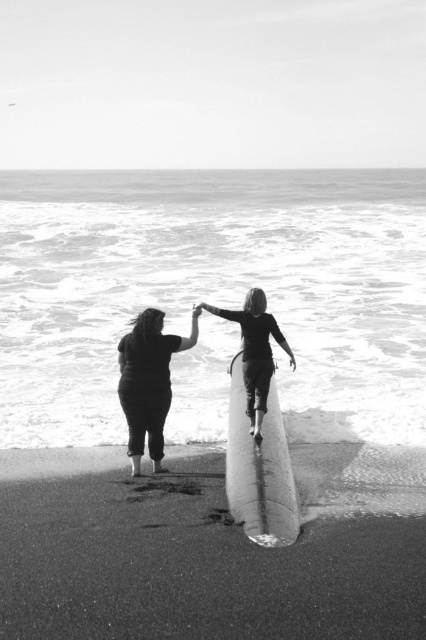
Image resolution: width=426 pixels, height=640 pixels. Find the location of `white foam water at center`. white foam water at center is located at coordinates (213, 291).

Which is above, white foam water at center or smooth sand at lower center?

white foam water at center is above.

Identify the location of white foam water at center. This screenshot has width=426, height=640. (213, 291).

This screenshot has width=426, height=640. I want to click on white foam water at center, so click(x=213, y=291).

Can you confirm if white foam water at center is smaller than matte black surfboard at center?

Incorrect, white foam water at center is not smaller in size than matte black surfboard at center.

Between white foam water at center and matte black surfboard at center, which one is positioned higher?

white foam water at center is higher up.

Is point (333, 308) in front of point (127, 344)?

No, (333, 308) is behind (127, 344).

You are a GUI agent. You are given a task and a screenshot of the screen. Output one action in this format:
    pyautogui.click(x=<x>, y=<y>)
    Task: Click on the white foam water at center
    This screenshot has height=640, width=426.
    Given the screenshot: What is the action you would take?
    pyautogui.click(x=213, y=291)

Consider the image. Is white foam water at center wider than smooth white surfboard at center?

Indeed, white foam water at center has a greater width compared to smooth white surfboard at center.

Image resolution: width=426 pixels, height=640 pixels. Describe the element at coordinates (213, 291) in the screenshot. I see `white foam water at center` at that location.

This screenshot has height=640, width=426. In order to click on white foam water at center in this screenshot , I will do `click(213, 291)`.